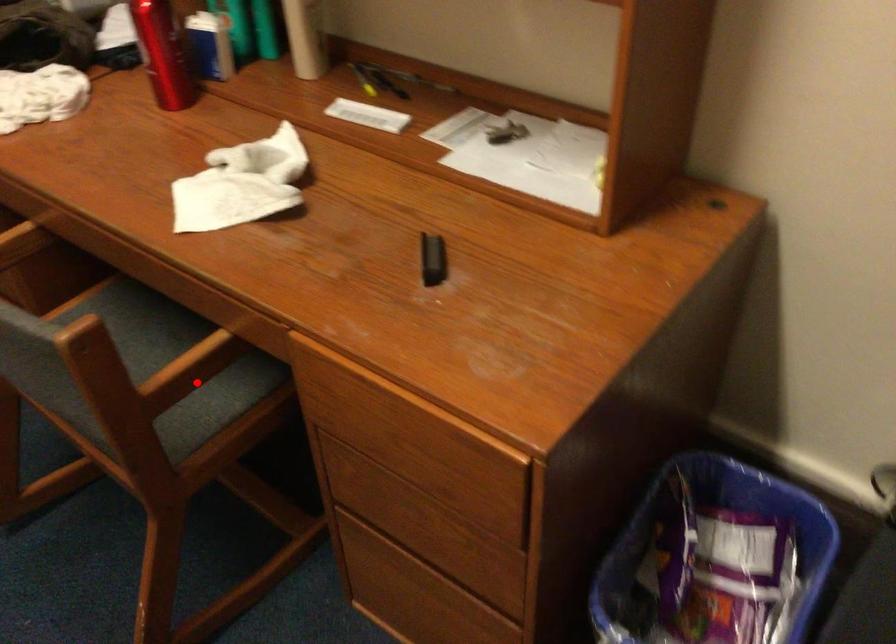
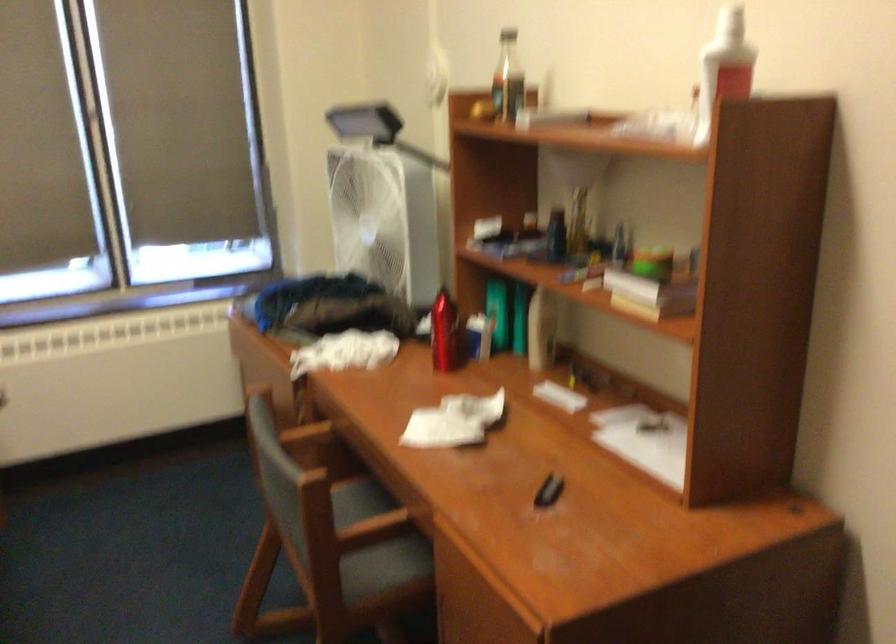
Where in the second image is the point corresponding to the highlighted location from the first image?

(375, 545)